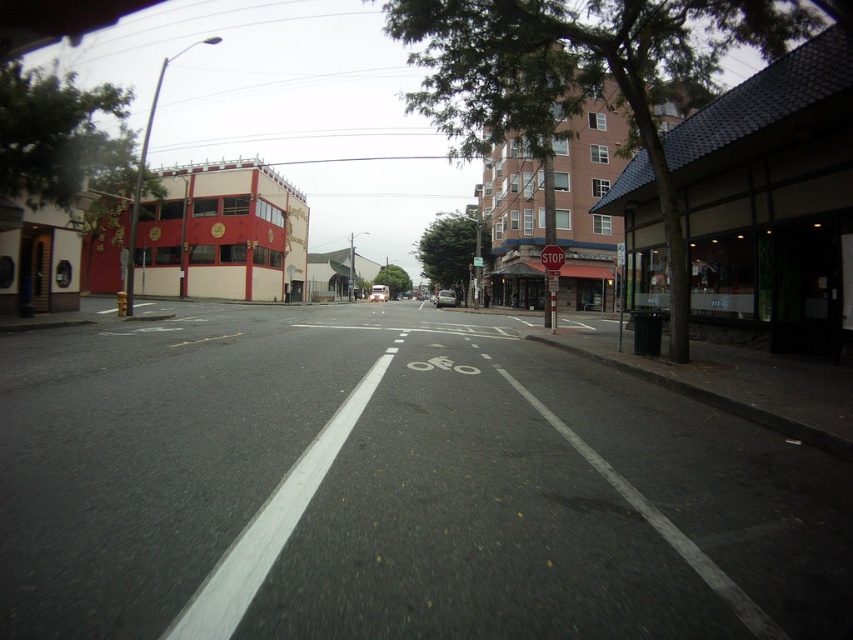
Question: Which point is closer to the camera taking this photo?

Choices:
 (A) (247, 161)
 (B) (550, 304)
 (C) (444, 433)

Answer: (C)

Question: Which object appears closest to the camera in this image?

Choices:
 (A) metallic silver van at center
 (B) red plastic stop sign at center
 (C) black asphalt road at center

Answer: (C)

Question: Does black asphalt road at center come in front of red plastic stop sign at center?

Choices:
 (A) no
 (B) yes

Answer: (B)

Question: Among these points, which one is farthest from the camera?

Choices:
 (A) (387, 292)
 (B) (561, 257)

Answer: (A)

Question: Does black asphalt road at center appear under red matte building at left?

Choices:
 (A) yes
 (B) no

Answer: (A)

Question: Does red matte stop sign at center have a greater width compared to metallic silver van at center?

Choices:
 (A) no
 (B) yes

Answer: (B)